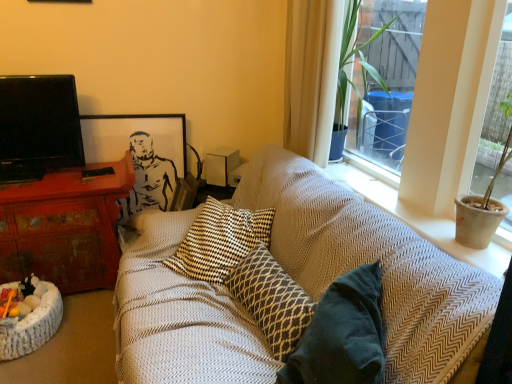
Question: Should I look upward or downward to see textured beige cushion at upper right?

Choices:
 (A) up
 (B) down

Answer: (A)

Question: Considering the relative sizes of textured beige cushion at upper right and white sheer curtain at upper right in the image provided, is textured beige cushion at upper right wider than white sheer curtain at upper right?

Choices:
 (A) no
 (B) yes

Answer: (B)

Question: From a real-world perspective, is textured beige cushion at upper right on top of white sheer curtain at upper right?

Choices:
 (A) yes
 (B) no

Answer: (B)

Question: Is textured beige cushion at upper right positioned with its back to white sheer curtain at upper right?

Choices:
 (A) yes
 (B) no

Answer: (B)

Question: Are textured beige cushion at upper right and white sheer curtain at upper right making contact?

Choices:
 (A) no
 (B) yes

Answer: (A)

Question: From a real-world perspective, is textured beige cushion at upper right beneath white sheer curtain at upper right?

Choices:
 (A) no
 (B) yes

Answer: (B)

Question: Is textured beige cushion at upper right smaller than white sheer curtain at upper right?

Choices:
 (A) no
 (B) yes

Answer: (A)

Question: Is distressed wood desk at left not within white matte speaker at upper center?

Choices:
 (A) yes
 (B) no

Answer: (A)

Question: Can you confirm if distressed wood desk at left is wider than white matte speaker at upper center?

Choices:
 (A) no
 (B) yes

Answer: (B)

Question: Is white matte speaker at upper center located within distressed wood desk at left?

Choices:
 (A) yes
 (B) no

Answer: (B)

Question: Is distressed wood desk at left aimed at white matte speaker at upper center?

Choices:
 (A) yes
 (B) no

Answer: (B)

Question: From a real-world perspective, is distressed wood desk at left over white matte speaker at upper center?

Choices:
 (A) yes
 (B) no

Answer: (B)

Question: Considering the relative positions of distressed wood desk at left and white matte speaker at upper center in the image provided, is distressed wood desk at left to the left of white matte speaker at upper center from the viewer's perspective?

Choices:
 (A) yes
 (B) no

Answer: (A)

Question: Is black glossy tv at left thinner than distressed wood desk at left?

Choices:
 (A) no
 (B) yes

Answer: (B)